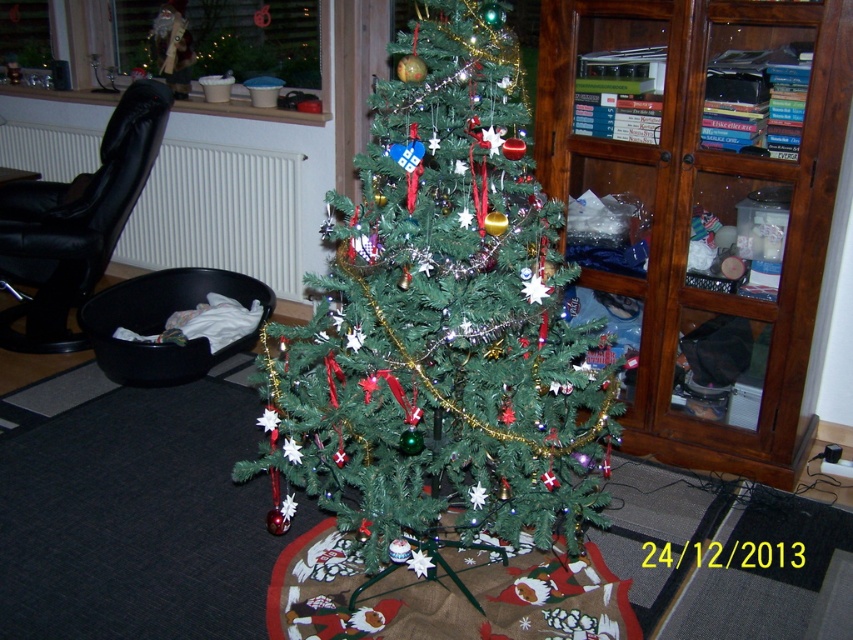
Is green matte christmas tree at center to the left of wooden cabinet at right from the viewer's perspective?

Correct, you'll find green matte christmas tree at center to the left of wooden cabinet at right.

Which is behind, point (361, 268) or point (666, 157)?

The point (666, 157) is more distant.

Between point (509, 244) and point (833, 150), which one is positioned behind?

Positioned behind is point (833, 150).

Where is `green matte christmas tree at center`? green matte christmas tree at center is located at coordinates (442, 321).